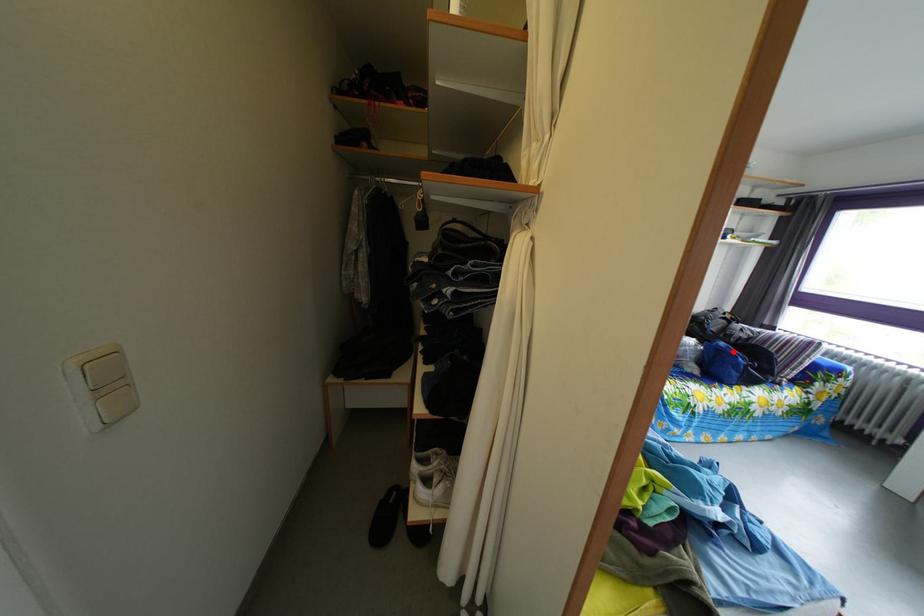
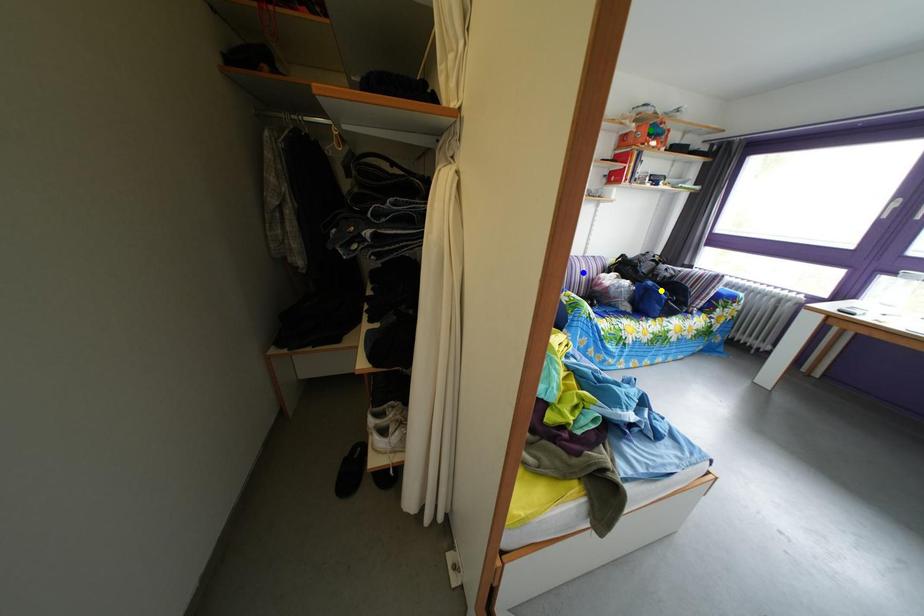
Question: I am providing you with two images of the same scene from different viewpoints. A red point is marked on the first image. You are given multiple points on the second image. Can you choose the point in image 2 that corresponds to the point in image 1?

Choices:
 (A) yellow point
 (B) blue point
 (C) green point

Answer: (A)